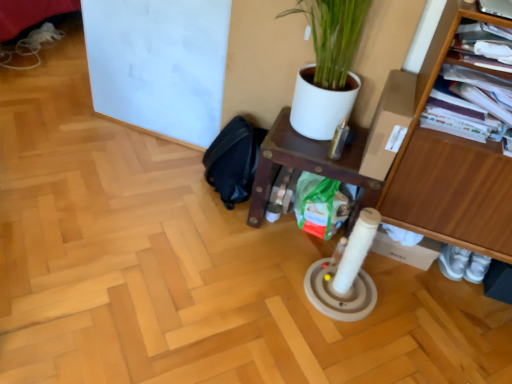
Question: Does black fabric swivel chair at lower center have a larger size compared to wooden shelf at right?

Choices:
 (A) yes
 (B) no

Answer: (B)

Question: Considering the relative positions of black fabric swivel chair at lower center and wooden shelf at right in the image provided, is black fabric swivel chair at lower center to the right of wooden shelf at right from the viewer's perspective?

Choices:
 (A) no
 (B) yes

Answer: (A)

Question: Considering the relative sizes of black fabric swivel chair at lower center and wooden shelf at right in the image provided, is black fabric swivel chair at lower center taller than wooden shelf at right?

Choices:
 (A) no
 (B) yes

Answer: (A)

Question: Does black fabric swivel chair at lower center have a greater width compared to wooden shelf at right?

Choices:
 (A) yes
 (B) no

Answer: (B)

Question: From the image's perspective, is black fabric swivel chair at lower center beneath wooden shelf at right?

Choices:
 (A) yes
 (B) no

Answer: (B)

Question: Looking at their shapes, would you say wooden shelf at right is wider or thinner than wooden shelf at center?

Choices:
 (A) thin
 (B) wide

Answer: (A)

Question: Based on their sizes in the image, would you say wooden shelf at right is bigger or smaller than wooden shelf at center?

Choices:
 (A) small
 (B) big

Answer: (B)

Question: From the image's perspective, is wooden shelf at right located above or below wooden shelf at center?

Choices:
 (A) above
 (B) below

Answer: (A)

Question: Relative to wooden shelf at center, is wooden shelf at right in front or behind?

Choices:
 (A) front
 (B) behind

Answer: (A)

Question: From their relative heights in the image, would you say wooden shelf at right is taller or shorter than black fabric swivel chair at lower center?

Choices:
 (A) short
 (B) tall

Answer: (B)

Question: Relative to black fabric swivel chair at lower center, is wooden shelf at right in front or behind?

Choices:
 (A) behind
 (B) front

Answer: (B)

Question: Is point (503, 177) positioned closer to the camera than point (218, 148)?

Choices:
 (A) farther
 (B) closer

Answer: (B)

Question: Considering the positions of wooden shelf at right and black fabric swivel chair at lower center in the image, is wooden shelf at right bigger or smaller than black fabric swivel chair at lower center?

Choices:
 (A) small
 (B) big

Answer: (B)

Question: Would you say black fabric swivel chair at lower center is inside or outside wooden shelf at center?

Choices:
 (A) inside
 (B) outside

Answer: (B)

Question: In terms of size, does black fabric swivel chair at lower center appear bigger or smaller than wooden shelf at center?

Choices:
 (A) big
 (B) small

Answer: (B)